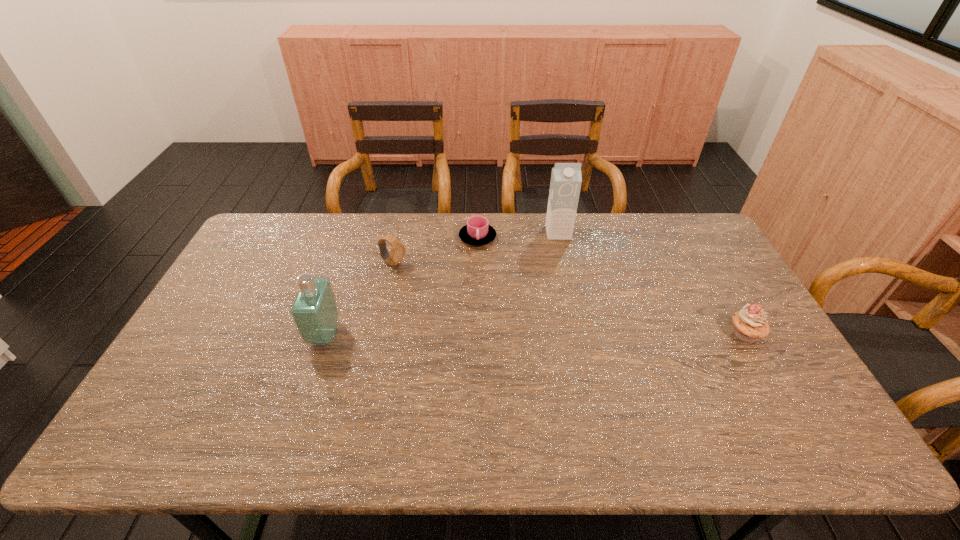
You are a GUI agent. You are given a task and a screenshot of the screen. Output one action in this format:
    pyautogui.click(x=<x>, y=<y>)
    Task: Click on the free spot located 0.140m on the front label of the leftmost object
    The width and height of the screenshot is (960, 540).
    Given the screenshot: What is the action you would take?
    pyautogui.click(x=261, y=335)

This screenshot has height=540, width=960. In order to click on vacant point located on the front label of the leftmost object in this screenshot , I will do `click(286, 335)`.

At what (x,y) coordinates should I click in order to perform the action: click on vacant area situated 0.120m on the front of the rightmost object. Please return your answer as a coordinate pair (x, y). The height and width of the screenshot is (540, 960). Looking at the image, I should click on (774, 385).

Identify the location of vacant region located on the face of the fourth object from right to left. The width and height of the screenshot is (960, 540). (471, 301).

Identify the location of vacant space located 0.350m on the face of the fourth object from right to left. Image resolution: width=960 pixels, height=540 pixels. (494, 311).

The image size is (960, 540). Identify the location of blank space located 0.380m on the face of the fourth object from right to left. (503, 315).

Find the location of a particular element. The height and width of the screenshot is (540, 960). vacant space located on the front label of the second object from right to left is located at coordinates (563, 256).

The image size is (960, 540). In order to click on vacant area located on the front label of the second object from right to left in this screenshot , I will do (x=564, y=266).

Identify the location of vacant space located 0.270m on the front label of the second object from right to left. (570, 294).

This screenshot has width=960, height=540. In order to click on vacant space located on the side with the handle of the cup in this screenshot , I will do click(x=521, y=326).